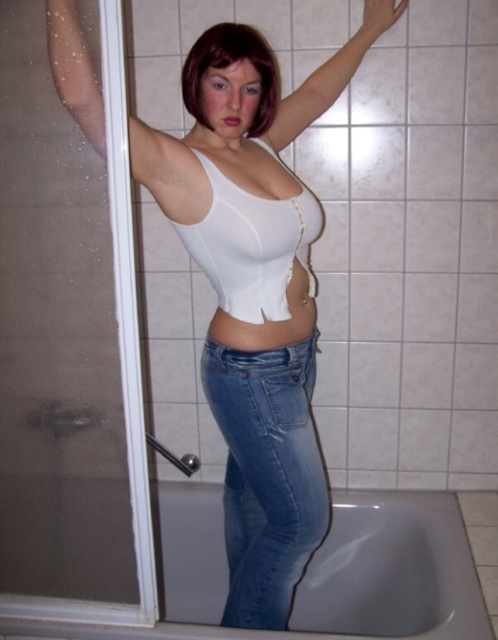
You are a delivery person who needs to place a small package exactly at the point marked as point (442, 609). The package must be placed within 5 feet of the person. Can you safely place the package there?

The distance between the person and point (442, 609) is 4.59 feet, which is within the 5 feet requirement. Yes, you can safely place the package there.

You are designing a bathroom layout and need to place a new shelf. The shelf must be placed either on the wall behind the white glossy bathtub at lower center or next to the transparent glass screen door at left. Which location has more space for the shelf?

The white glossy bathtub at lower center is larger in size than the transparent glass screen door at left, so placing the shelf behind the bathtub would provide more space.

Looking at this image, you are designing a new line of activewear and need to ensure that the clothing items can move freely without restricting motion. Based on the image, which item between the blue denim jeans at lower center and the white matte arm at upper center takes up more space?

The blue denim jeans at lower center takes up more space than the white matte arm at upper center because it is bigger in size according to the description.